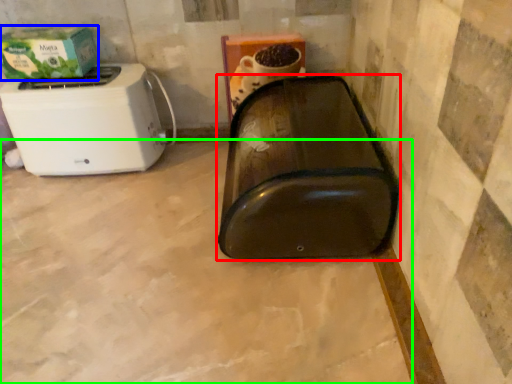
Question: Estimate the real-world distances between objects in this image. Which object is farther from appliance (highlighted by a red box), box (highlighted by a blue box) or concrete (highlighted by a green box)?

Choices:
 (A) box
 (B) concrete

Answer: (A)